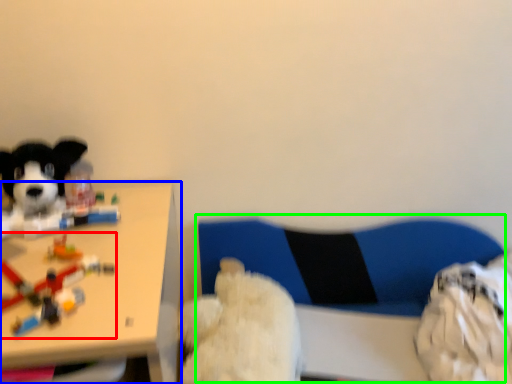
Question: Estimate the real-world distances between objects in this image. Which object is farther from toy (highlighted by a red box), table (highlighted by a blue box) or swivel chair (highlighted by a green box)?

Choices:
 (A) table
 (B) swivel chair

Answer: (B)